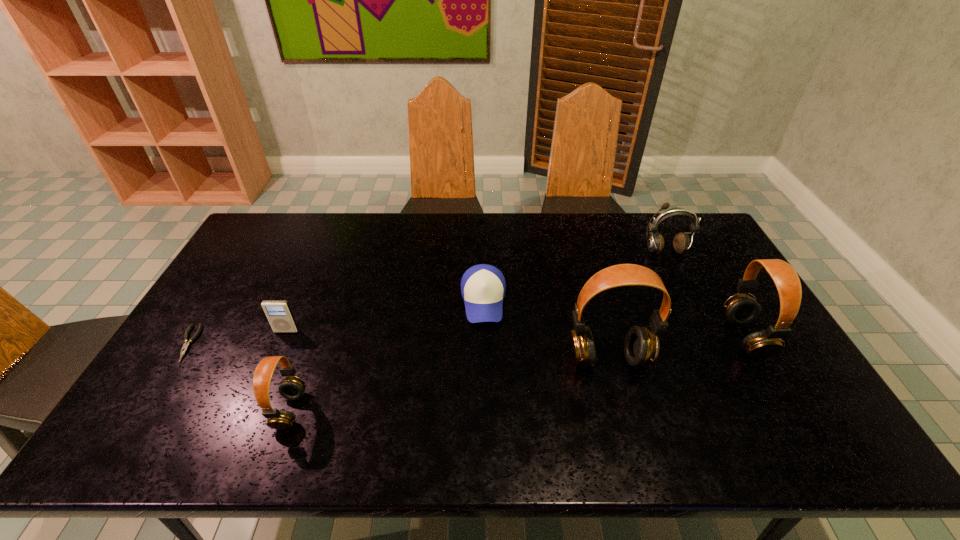
You are a GUI agent. You are given a task and a screenshot of the screen. Output one action in this format:
    pyautogui.click(x=<x>, y=<y>)
    Task: Click on the object that is positioned at the left edge
    
    Given the screenshot: What is the action you would take?
    pyautogui.click(x=186, y=345)

Where is `headset at the right edge`? headset at the right edge is located at coordinates (740, 309).

Locate an element on the screen. This screenshot has width=960, height=540. earphone that is positioned at the right edge is located at coordinates (681, 243).

At what (x,y) coordinates should I click in order to perform the action: click on object that is at the far right corner. Please return your answer as a coordinate pair (x, y). Looking at the image, I should click on (681, 243).

In the image, there is a desktop. At what (x,y) coordinates should I click in order to perform the action: click on vacant space at the far edge. Please return your answer as a coordinate pair (x, y). Looking at the image, I should click on (582, 242).

In the image, there is a desktop. Identify the location of free space at the near edge. (230, 398).

Find the location of a particular element. This screenshot has width=960, height=540. free region at the left edge of the desktop is located at coordinates (194, 325).

Where is `vacant space at the far left corner of the desktop`? The width and height of the screenshot is (960, 540). vacant space at the far left corner of the desktop is located at coordinates (250, 245).

Identify the location of blank space at the near right corner of the desktop. (785, 412).

This screenshot has width=960, height=540. Find the location of `free space between the nearest headset and the fifth object from left to right`. free space between the nearest headset and the fifth object from left to right is located at coordinates (449, 384).